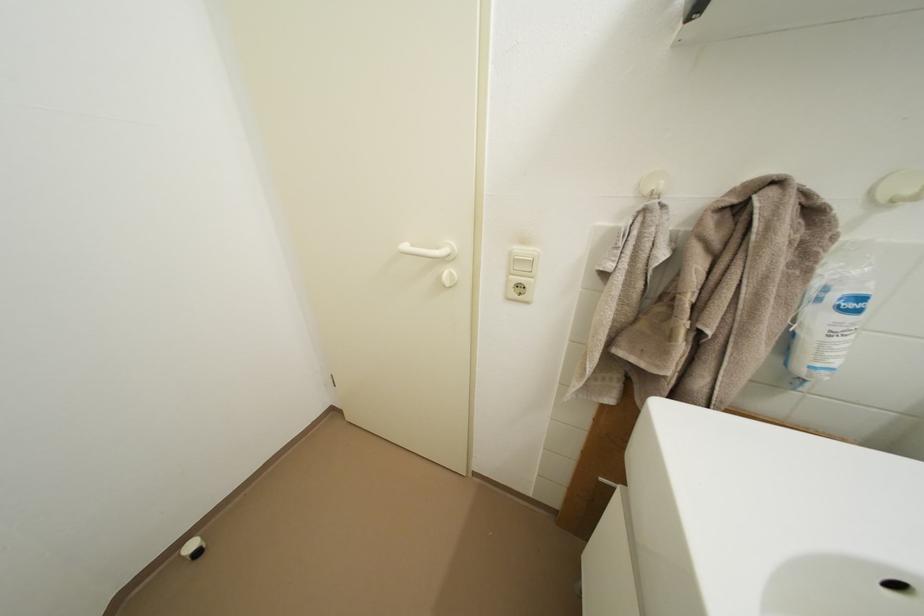
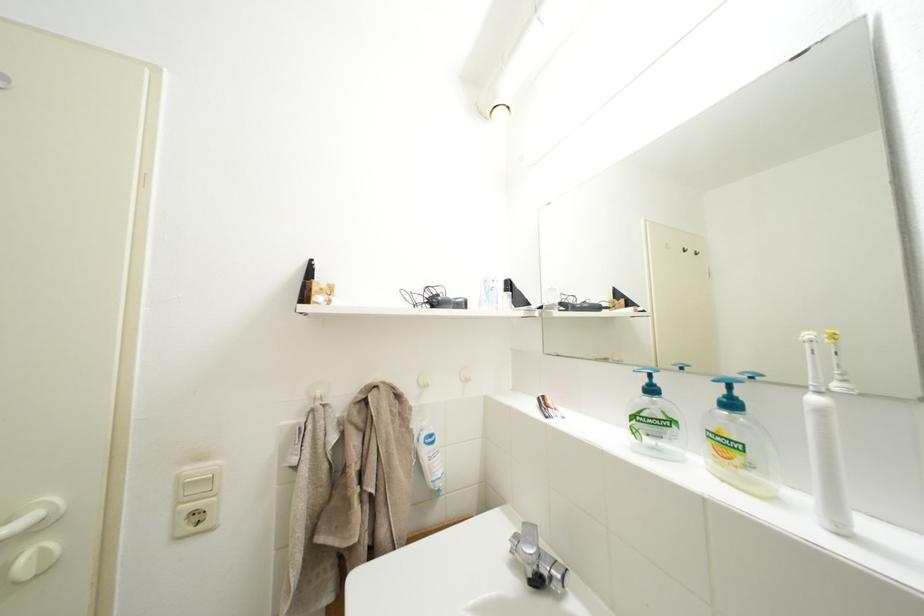
Locate, in the second image, the point that corresponds to (517,286) in the first image.

(185, 519)